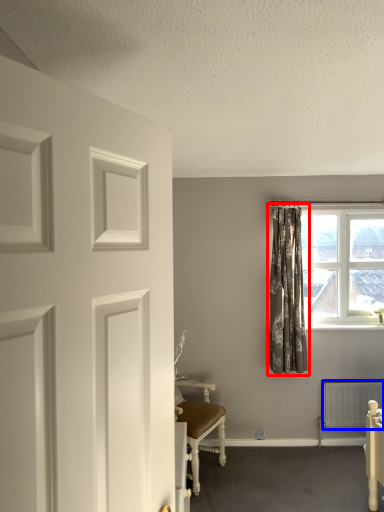
Question: Which point is further to the camera, curtain (highlighted by a red box) or radiator (highlighted by a blue box)?

Choices:
 (A) curtain
 (B) radiator

Answer: (B)